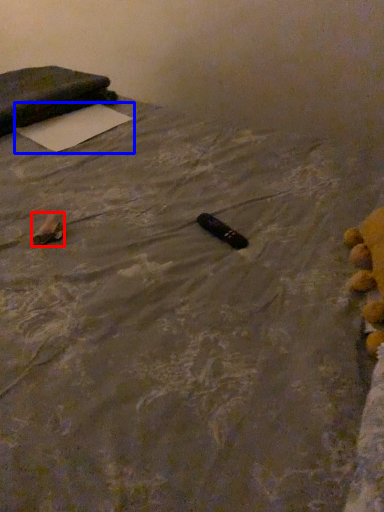
Question: Which object appears farthest to the camera in this image, waste (highlighted by a red box) or yoga mat (highlighted by a blue box)?

Choices:
 (A) waste
 (B) yoga mat

Answer: (B)